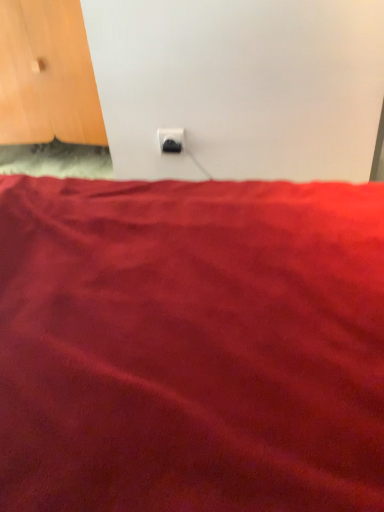
You are a GUI agent. You are given a task and a screenshot of the screen. Output one action in this format:
    pyautogui.click(x=<x>, y=<y>)
    Task: Click on the wooden door at upper left
    This screenshot has height=512, width=384.
    Given the screenshot: What is the action you would take?
    pyautogui.click(x=47, y=75)

What is the approximate width of wooden door at upper left?

The width of wooden door at upper left is 18.08 inches.

Describe the element at coordinates (47, 75) in the screenshot. The width and height of the screenshot is (384, 512). I see `wooden door at upper left` at that location.

Image resolution: width=384 pixels, height=512 pixels. What do you see at coordinates (171, 140) in the screenshot?
I see `black plastic power plug at center` at bounding box center [171, 140].

Where is `black plastic power plug at center`? black plastic power plug at center is located at coordinates (171, 140).

Locate an element on the screen. Image resolution: width=384 pixels, height=512 pixels. wooden door at upper left is located at coordinates (47, 75).

In the scene shown: Visually, is wooden door at upper left positioned to the left or to the right of black plastic power plug at center?

In the image, wooden door at upper left appears on the left side of black plastic power plug at center.

Looking at this image, which is behind, wooden door at upper left or black plastic power plug at center?

wooden door at upper left is further from the camera.

Between point (47, 111) and point (178, 142), which one is positioned behind?

Positioned behind is point (47, 111).

From the image's perspective, would you say wooden door at upper left is positioned over black plastic power plug at center?

Yes, from the image's perspective, wooden door at upper left is above black plastic power plug at center.

From a real-world perspective, does wooden door at upper left stand above black plastic power plug at center?

Indeed, from a real-world perspective, wooden door at upper left stands above black plastic power plug at center.

Is wooden door at upper left wider or thinner than black plastic power plug at center?

Clearly, wooden door at upper left has more width compared to black plastic power plug at center.

Considering the relative sizes of wooden door at upper left and black plastic power plug at center in the image provided, is wooden door at upper left shorter than black plastic power plug at center?

No.

Considering the sizes of objects wooden door at upper left and black plastic power plug at center in the image provided, who is bigger, wooden door at upper left or black plastic power plug at center?

wooden door at upper left.

Is wooden door at upper left outside of black plastic power plug at center?

Yes.

Would you consider wooden door at upper left to be distant from black plastic power plug at center?

Actually, wooden door at upper left and black plastic power plug at center are a little close together.

Is wooden door at upper left looking in the opposite direction of black plastic power plug at center?

That's not correct — wooden door at upper left is not looking away from black plastic power plug at center.

Can you tell me how much wooden door at upper left and black plastic power plug at center differ in facing direction?

0.00901 degrees separate the facing orientations of wooden door at upper left and black plastic power plug at center.

How far apart are wooden door at upper left and black plastic power plug at center?

A distance of 62.62 centimeters exists between wooden door at upper left and black plastic power plug at center.

Locate an element on the screen. This screenshot has height=512, width=384. door lying behind the black plastic power plug at center is located at coordinates (47, 75).

Would you say black plastic power plug at center is to the left or to the right of wooden door at upper left in the picture?

black plastic power plug at center is to the right of wooden door at upper left.

Between black plastic power plug at center and wooden door at upper left, which one is positioned behind?

wooden door at upper left is further away from the camera.

Is point (159, 141) farther from viewer compared to point (7, 70)?

No.

From the image's perspective, is black plastic power plug at center under wooden door at upper left?

Correct, black plastic power plug at center appears lower than wooden door at upper left in the image.

From a real-world perspective, is black plastic power plug at center physically below wooden door at upper left?

Correct, in the physical world, black plastic power plug at center is lower than wooden door at upper left.

Does black plastic power plug at center have a lesser width compared to wooden door at upper left?

Correct, the width of black plastic power plug at center is less than that of wooden door at upper left.

Can you confirm if black plastic power plug at center is taller than wooden door at upper left?

No, black plastic power plug at center is not taller than wooden door at upper left.

Can you confirm if black plastic power plug at center is smaller than wooden door at upper left?

Indeed, black plastic power plug at center has a smaller size compared to wooden door at upper left.

Is black plastic power plug at center not inside wooden door at upper left?

black plastic power plug at center lies outside wooden door at upper left's area.

Is black plastic power plug at center far away from wooden door at upper left?

No, there isn't a large distance between black plastic power plug at center and wooden door at upper left.

Is wooden door at upper left at the back of black plastic power plug at center?

That's not correct — black plastic power plug at center is not looking away from wooden door at upper left.

Can you tell me how much black plastic power plug at center and wooden door at upper left differ in facing direction?

The facing directions of black plastic power plug at center and wooden door at upper left are 0.00901 degrees apart.

The height and width of the screenshot is (512, 384). I want to click on door above the black plastic power plug at center (from the image's perspective), so click(x=47, y=75).

In order to click on power plugs and sockets located in front of the wooden door at upper left in this screenshot , I will do `click(171, 140)`.

The height and width of the screenshot is (512, 384). I want to click on power plugs and sockets below the wooden door at upper left (from the image's perspective), so click(x=171, y=140).